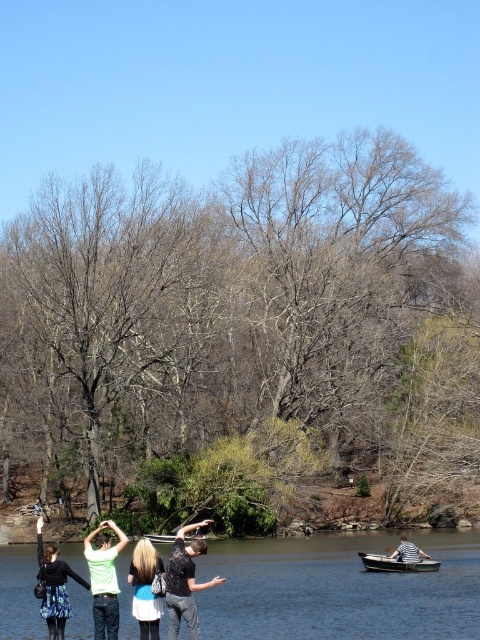
You are trying to take a photo of the blue water at lower center and the blue denim jacket at center. Which object appears wider in the photo?

The blue water at lower center appears wider than the blue denim jacket at center because its width is larger.

You are a photographer trying to capture a photo of the green matte shirt at center and the matte black dress at lower left. Based on their positions, which one is higher up in the frame?

The green matte shirt at center is above the matte black dress at lower left, so it is higher up in the frame.

You are standing at the edge of the water in the scene and want to walk to the two points marked in the image. Which point, point [93,531] or point [411,548], is closer to you?

Point [93,531] is closer to you because it is further to the viewer than point [411,548].